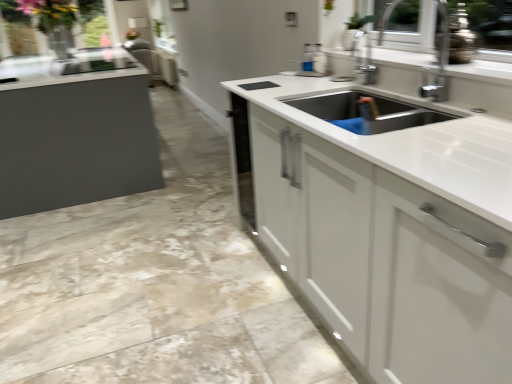
Question: In terms of height, does transparent glass window screen at upper left look taller or shorter compared to white glossy countertop at center?

Choices:
 (A) tall
 (B) short

Answer: (A)

Question: From a real-world perspective, is transparent glass window screen at upper left above or below white glossy countertop at center?

Choices:
 (A) below
 (B) above

Answer: (B)

Question: Considering their positions, is transparent glass window screen at upper left located in front of or behind white glossy countertop at center?

Choices:
 (A) front
 (B) behind

Answer: (B)

Question: Do you think white glossy countertop at center is within transparent glass window screen at upper left, or outside of it?

Choices:
 (A) inside
 (B) outside

Answer: (B)

Question: Is white glossy countertop at center to the left or to the right of transparent glass window screen at upper left in the image?

Choices:
 (A) left
 (B) right

Answer: (B)

Question: Is white glossy countertop at center taller or shorter than transparent glass window screen at upper left?

Choices:
 (A) short
 (B) tall

Answer: (A)

Question: From a real-world perspective, relative to transparent glass window screen at upper left, is white glossy countertop at center vertically above or below?

Choices:
 (A) above
 (B) below

Answer: (B)